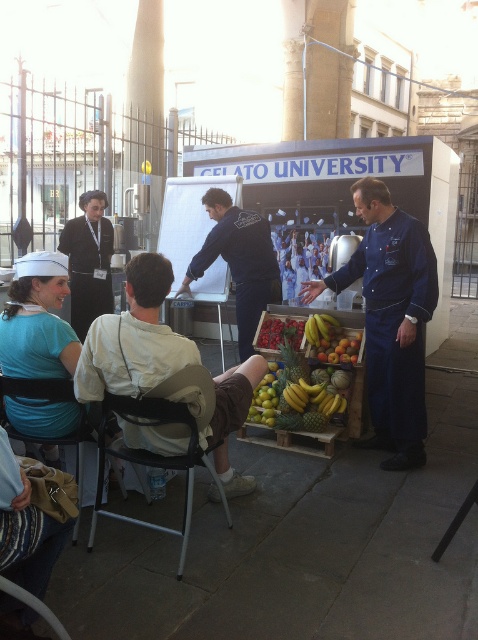
You are standing in front of the gelato demonstration and want to move closer to the two points marked in the image. Which point, point (178, 353) or point (78, 490), is closer to you?

Point (178, 353) is closer to the viewer than point (78, 490).

You are a participant in the gelato class and want to approach the chef in the matte blue uniform at lower left. There is also a person in the black fabric uniform at left blocking your path. Can you walk around them to reach the chef?

The matte blue uniform at lower left is closer to the viewer than the black fabric uniform at left, so the black fabric uniform at left is further away. Since the black fabric uniform at left is further away, you can walk around them to reach the chef in the matte blue uniform at lower left.